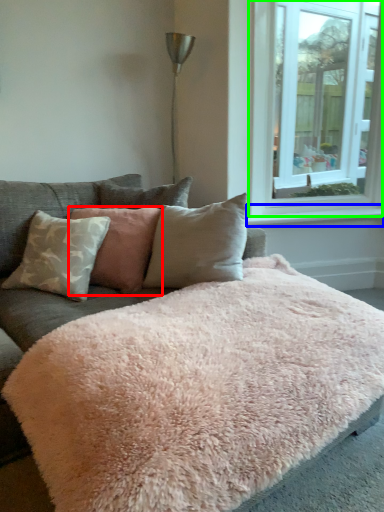
Question: Which object is the farthest from pillow (highlighted by a red box)? Choose among these: window sill (highlighted by a blue box) or window (highlighted by a green box).

Choices:
 (A) window sill
 (B) window

Answer: (B)